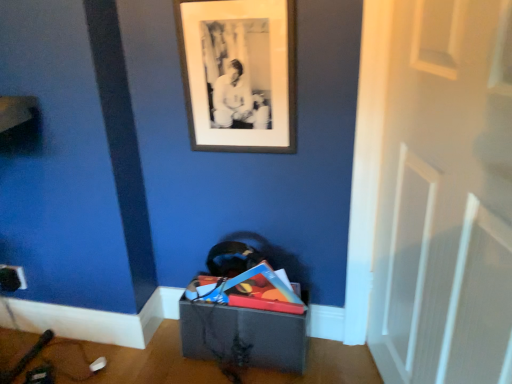
The image size is (512, 384). In order to click on white matte door at center in this screenshot , I will do `click(445, 196)`.

Identify the location of white matte door at center. (445, 196).

Looking at this image, from the image's perspective, is matte gray storage box at lower center beneath white matte door at center?

Yes, from the image's perspective, matte gray storage box at lower center is beneath white matte door at center.

Is matte gray storage box at lower center not inside white matte door at center?

matte gray storage box at lower center lies outside white matte door at center's area.

Is matte gray storage box at lower center taller than white matte door at center?

In fact, matte gray storage box at lower center may be shorter than white matte door at center.

Which is nearer, [273,322] or [492,318]?

Point [273,322] appears to be farther away from the viewer than point [492,318].

In the scene shown: Do you think matte gray storage box at lower center is within black matte picture frame at upper center, or outside of it?

matte gray storage box at lower center is located beyond the bounds of black matte picture frame at upper center.

Between matte gray storage box at lower center and black matte picture frame at upper center, which one is positioned behind?

matte gray storage box at lower center is behind.

Based on the photo, who is bigger, matte gray storage box at lower center or black matte picture frame at upper center?

Bigger between the two is matte gray storage box at lower center.

Is white matte door at center aimed at matte gray storage box at lower center?

Yes, white matte door at center faces towards matte gray storage box at lower center.

Is point (439, 182) farther from camera compared to point (269, 359)?

No, (439, 182) is in front of (269, 359).

From the picture: From a real-world perspective, is white matte door at center physically above matte gray storage box at lower center?

Correct, in the physical world, white matte door at center is higher than matte gray storage box at lower center.

Between white matte door at center and matte gray storage box at lower center, which one is positioned in front?

white matte door at center.

From the image's perspective, is black matte picture frame at upper center positioned above or below matte gray storage box at lower center?

black matte picture frame at upper center is situated higher than matte gray storage box at lower center in the image.

Considering the relative sizes of black matte picture frame at upper center and matte gray storage box at lower center in the image provided, is black matte picture frame at upper center thinner than matte gray storage box at lower center?

Yes.

Is black matte picture frame at upper center looking in the opposite direction of matte gray storage box at lower center?

black matte picture frame at upper center does not have its back to matte gray storage box at lower center.

From the image's perspective, between black matte picture frame at upper center and white matte door at center, who is located below?

white matte door at center, from the image's perspective.

Based on the photo, is black matte picture frame at upper center smaller than white matte door at center?

Yes, black matte picture frame at upper center is smaller than white matte door at center.

Considering the sizes of objects black matte picture frame at upper center and white matte door at center in the image provided, who is wider, black matte picture frame at upper center or white matte door at center?

Wider between the two is white matte door at center.

Is the depth of black matte picture frame at upper center less than that of white matte door at center?

No, black matte picture frame at upper center is behind white matte door at center.

From the image's perspective, is white matte door at center above or below black matte picture frame at upper center?

From the image's perspective, white matte door at center appears below black matte picture frame at upper center.

Can you confirm if white matte door at center is taller than black matte picture frame at upper center?

Yes.

From a real-world perspective, is white matte door at center physically below black matte picture frame at upper center?

Yes, from a real-world perspective, white matte door at center is beneath black matte picture frame at upper center.

How far apart are white matte door at center and black matte picture frame at upper center?

white matte door at center is 17.14 inches from black matte picture frame at upper center.

You are a GUI agent. You are given a task and a screenshot of the screen. Output one action in this format:
    pyautogui.click(x=<x>, y=<y>)
    Task: Click on the door above the matte gray storage box at lower center (from a real-world perspective)
    This screenshot has width=512, height=384.
    Given the screenshot: What is the action you would take?
    pyautogui.click(x=445, y=196)

At what (x,y) coordinates should I click in order to perform the action: click on storage box that is below the black matte picture frame at upper center (from the image's perspective). Please return your answer as a coordinate pair (x, y). This screenshot has height=384, width=512. Looking at the image, I should click on (245, 329).

From the image, which object appears to be farther from white matte door at center, black matte picture frame at upper center or matte gray storage box at lower center?

The object further to white matte door at center is matte gray storage box at lower center.

Estimate the real-world distances between objects in this image. Which object is further from white matte door at center, matte gray storage box at lower center or black matte picture frame at upper center?

matte gray storage box at lower center is further to white matte door at center.

Based on their spatial positions, is matte gray storage box at lower center or white matte door at center further from black matte picture frame at upper center?

matte gray storage box at lower center lies further to black matte picture frame at upper center than the other object.

Which object lies nearer to the anchor point black matte picture frame at upper center, white matte door at center or matte gray storage box at lower center?

white matte door at center is positioned closer to the anchor black matte picture frame at upper center.

Which object lies further to the anchor point matte gray storage box at lower center, white matte door at center or black matte picture frame at upper center?

black matte picture frame at upper center.

From the image, which object appears to be nearer to matte gray storage box at lower center, black matte picture frame at upper center or white matte door at center?

white matte door at center is closer to matte gray storage box at lower center.

This screenshot has height=384, width=512. Identify the location of door between black matte picture frame at upper center and matte gray storage box at lower center in the up-down direction. 445,196.